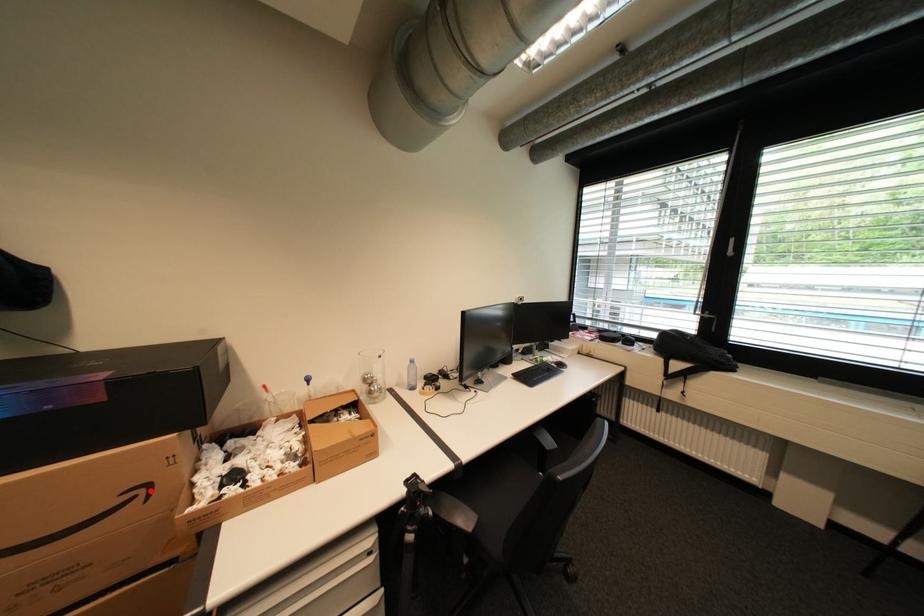
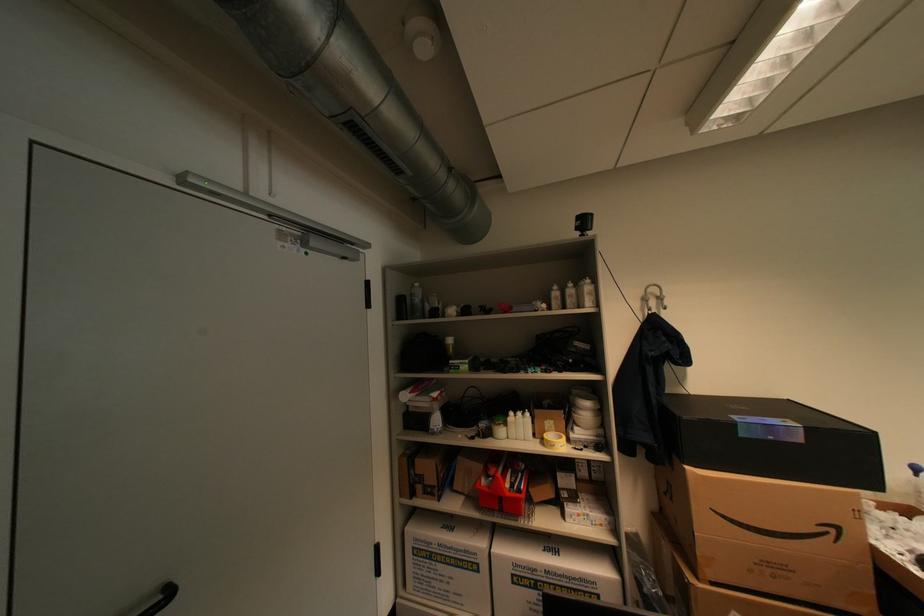
Question: I am providing you with two images of the same scene from different viewpoints. Given a red point in image1, look at the same physical point in image2. Is it:

Choices:
 (A) Closer to the viewpoint
 (B) Farther from the viewpoint

Answer: (A)